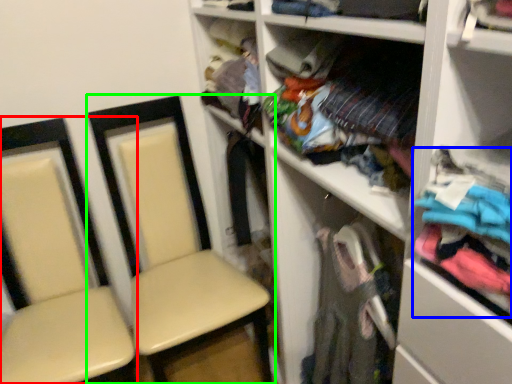
Question: Considering the real-world distances, which object is farthest from chair (highlighted by a red box)? clothing (highlighted by a blue box) or chair (highlighted by a green box)?

Choices:
 (A) clothing
 (B) chair

Answer: (A)